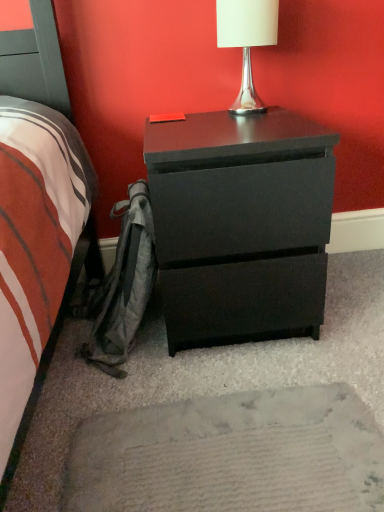
Image resolution: width=384 pixels, height=512 pixels. I want to click on free space in front of matte black chest of drawers at center, so click(236, 413).